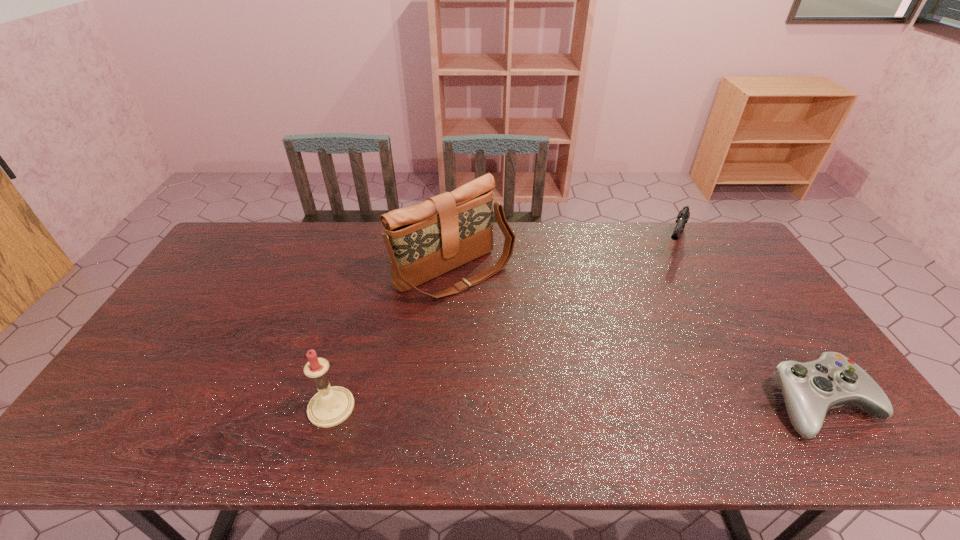
This screenshot has width=960, height=540. I want to click on unoccupied area between the second object from left to right and the gun, so click(564, 258).

Where is `free space between the candle and the third object from right to left`? Image resolution: width=960 pixels, height=540 pixels. free space between the candle and the third object from right to left is located at coordinates (394, 340).

Where is `free space between the leftmost object and the shortest object`? The height and width of the screenshot is (540, 960). free space between the leftmost object and the shortest object is located at coordinates (577, 406).

Identify the location of blank region between the shoulder bag and the shortest object. (639, 338).

This screenshot has width=960, height=540. What are the coordinates of `free space between the second object from left to right and the gun` in the screenshot? It's located at (564, 258).

Where is `vacant area that lies between the control and the second object from left to right`? vacant area that lies between the control and the second object from left to right is located at coordinates (639, 338).

The height and width of the screenshot is (540, 960). Identify the location of free space between the tallest object and the control. (639, 338).

What are the coordinates of `free space between the candle and the shoulder bag` in the screenshot? It's located at (394, 340).

Image resolution: width=960 pixels, height=540 pixels. Find the location of `object that is the third closest one to the second shortest object`. object that is the third closest one to the second shortest object is located at coordinates (331, 406).

Identify the location of object that is the third closest to the second object from left to right. Image resolution: width=960 pixels, height=540 pixels. (810, 389).